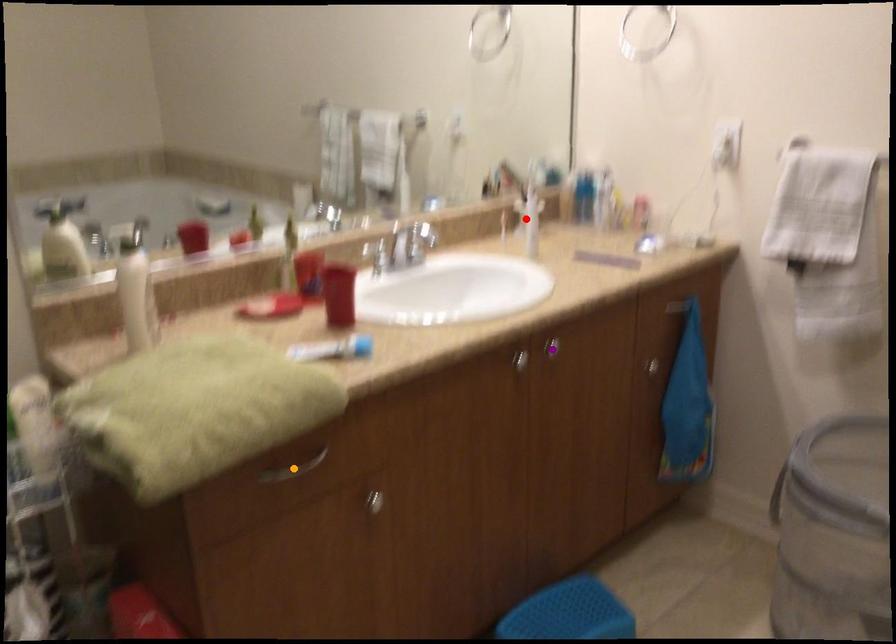
Order these from nearest to farthest:
purple point | red point | orange point

orange point
purple point
red point